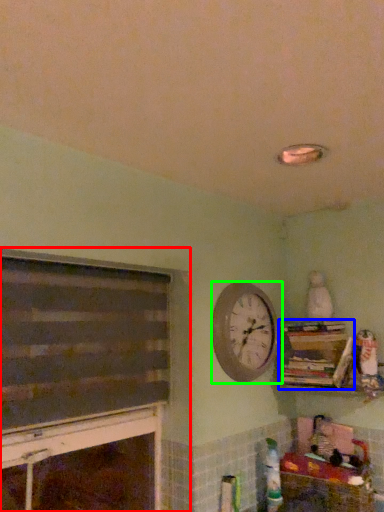
Question: Considering the real-world distances, which object is closest to fireplace (highlighted by a red box)? bookcase (highlighted by a blue box) or wall clock (highlighted by a green box).

Choices:
 (A) bookcase
 (B) wall clock

Answer: (B)